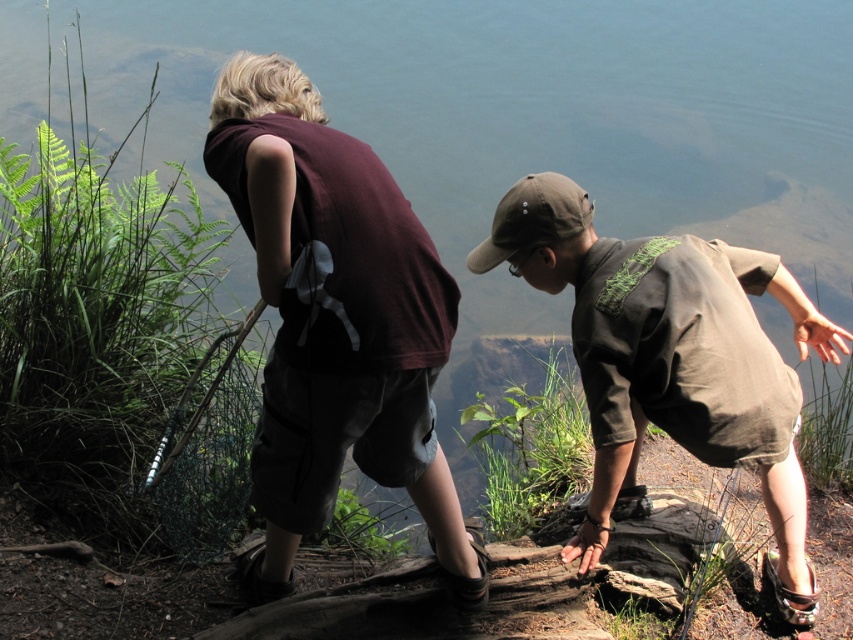
Is maroon fabric shirt at center thinner than brown cotton shirt at center?

Indeed, maroon fabric shirt at center has a lesser width compared to brown cotton shirt at center.

Is point (317, 410) closer to viewer compared to point (640, 400)?

Yes.

Between point (280, 284) and point (798, 296), which one is positioned in front?

Point (280, 284)

Locate an element on the screen. This screenshot has height=640, width=853. maroon fabric shirt at center is located at coordinates (335, 321).